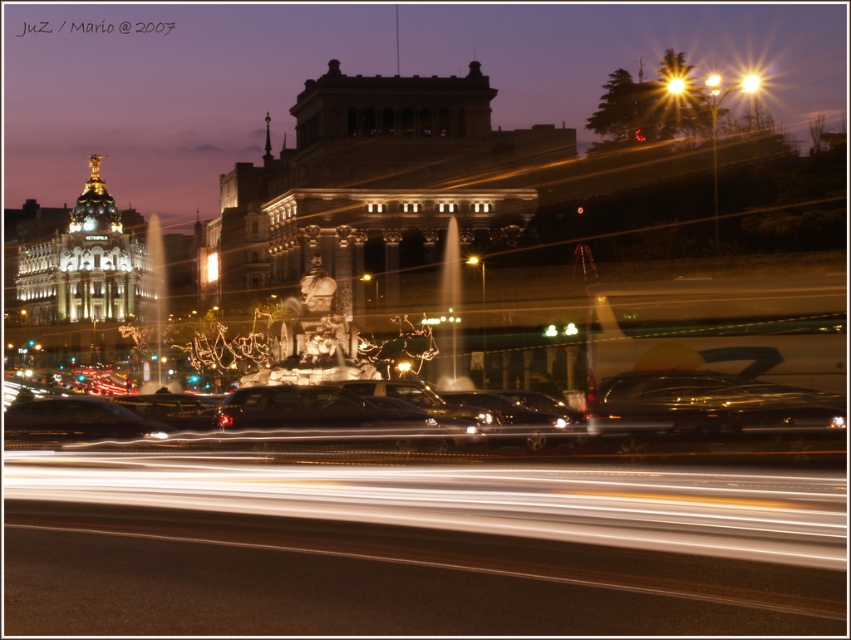
Is shiny black car at right wider than bright yellow streetlight at upper right?

Yes.

Can you confirm if shiny black car at right is shorter than bright yellow streetlight at upper right?

No.

Who is more distant from viewer, [711,401] or [671,92]?

Positioned behind is point [671,92].

What are the coordinates of `shiny black car at right` in the screenshot? It's located at (709, 410).

Can you confirm if black glossy car at center is wider than bright yellow light at upper center?

Yes.

Between black glossy car at center and bright yellow light at upper center, which one has more height?

With more height is bright yellow light at upper center.

Is point (378, 426) in front of point (744, 83)?

Yes, point (378, 426) is in front of point (744, 83).

Identify the location of black glossy car at center. (334, 419).

Who is lower down, gold metallic bell tower at upper left or black glossy car at center?

black glossy car at center

Is gold metallic bell tower at upper left closer to the viewer compared to black glossy car at center?

No, it is not.

Locate an element on the screen. The height and width of the screenshot is (640, 851). gold metallic bell tower at upper left is located at coordinates point(86,266).

Image resolution: width=851 pixels, height=640 pixels. What are the coordinates of `gold metallic bell tower at upper left` in the screenshot? It's located at 86,266.